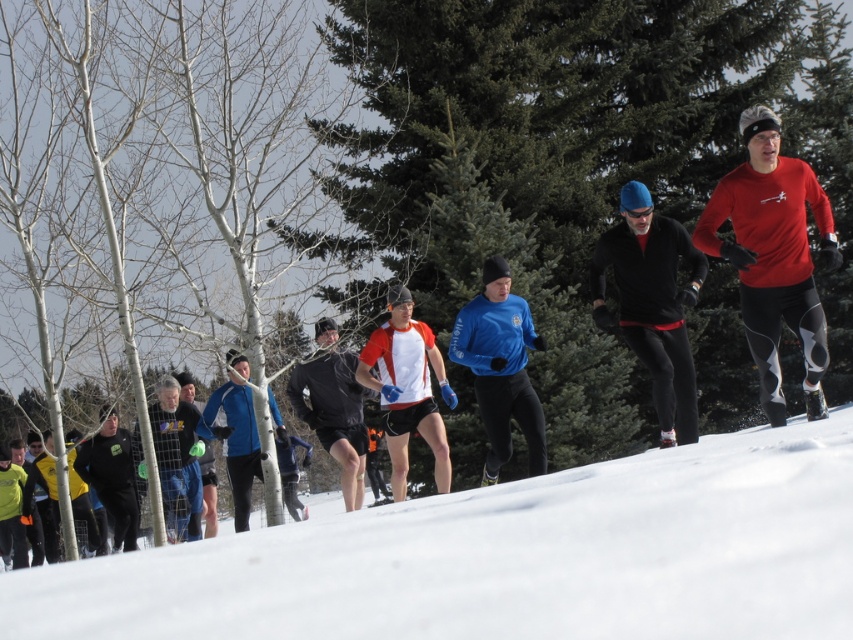
Question: Is black matte shorts at center smaller than blue fabric jacket at center?

Choices:
 (A) yes
 (B) no

Answer: (A)

Question: Which object is the closest to the blue fleece jacket at center?

Choices:
 (A) white snow at lower center
 (B) matte red long-sleeve shirt at right
 (C) matte red and white shirt at center

Answer: (C)

Question: Which point is closer to the camera?

Choices:
 (A) black fleece jacket at center
 (B) matte red and white shirt at center

Answer: (A)

Question: Does matte red and white shirt at center appear under blue fabric jacket at center?

Choices:
 (A) yes
 (B) no

Answer: (B)

Question: Does white snow at lower center have a greater width compared to blue fleece jacket at center?

Choices:
 (A) yes
 (B) no

Answer: (A)

Question: Which object is positioned farthest from the black fleece jacket at center?

Choices:
 (A) blue fleece jacket at center
 (B) blue fabric jacket at center
 (C) black matte shorts at center

Answer: (B)